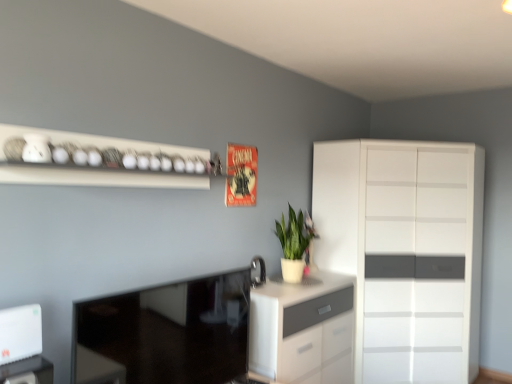
Describe the element at coordinates (302, 330) in the screenshot. This screenshot has width=512, height=384. I see `white matte chest of drawers at center` at that location.

How much space does satin nickel faucet at center, which is counted as the second appliance, starting from the front, occupy vertically?

7.86 inches.

Describe the element at coordinates (162, 334) in the screenshot. The height and width of the screenshot is (384, 512). I see `glossy black tv at lower left` at that location.

The width and height of the screenshot is (512, 384). Identify the location of white plastic router at lower left, which is the 1th appliance in left-to-right order. (20, 333).

Is the position of satin nickel faucet at center, marked as the 1th appliance in a back-to-front arrangement, less distant than that of white glossy cupboard at right?

Yes, the depth of satin nickel faucet at center, marked as the 1th appliance in a back-to-front arrangement, is less than that of white glossy cupboard at right.

Measure the distance between satin nickel faucet at center, acting as the second appliance starting from the left, and white glossy cupboard at right.

satin nickel faucet at center, acting as the second appliance starting from the left, and white glossy cupboard at right are 3.96 feet apart.

From a real-world perspective, starting from the white glossy cupboard at right, which appliance is the 2nd one vertically above it? Please provide its 2D coordinates.

[(260, 271)]

Considering the relative sizes of satin nickel faucet at center, marked as the 1th appliance in a back-to-front arrangement, and white glossy cupboard at right in the image provided, is satin nickel faucet at center, marked as the 1th appliance in a back-to-front arrangement, shorter than white glossy cupboard at right?

Yes, satin nickel faucet at center, marked as the 1th appliance in a back-to-front arrangement, is shorter than white glossy cupboard at right.

Are white matte chest of drawers at center and white glossy shelf at upper left far apart?

That's right, there is a large distance between white matte chest of drawers at center and white glossy shelf at upper left.

How different are the orientations of white matte chest of drawers at center and white glossy shelf at upper left in degrees?

There is a 0.0226-degree angle between the facing directions of white matte chest of drawers at center and white glossy shelf at upper left.

Between white matte chest of drawers at center and white glossy shelf at upper left, which one appears on the left side from the viewer's perspective?

From the viewer's perspective, white glossy shelf at upper left appears more on the left side.

Is white matte chest of drawers at center thinner than white glossy shelf at upper left?

No, white matte chest of drawers at center is not thinner than white glossy shelf at upper left.

From a real-world perspective, who is located lower, white matte chest of drawers at center or white plastic router at lower left, the 2th appliance in the back-to-front sequence?

white matte chest of drawers at center, from a real-world perspective.

Is white matte chest of drawers at center with white plastic router at lower left, the 2th appliance in the back-to-front sequence?

No.

Which is farther, (x=317, y=307) or (x=34, y=320)?

Positioned behind is point (x=317, y=307).

Which is more to the right, white matte chest of drawers at center or white plastic router at lower left, the 2th appliance in the back-to-front sequence?

From the viewer's perspective, white matte chest of drawers at center appears more on the right side.

Visually, is satin nickel faucet at center, which is counted as the second appliance, starting from the front, positioned to the left or to the right of white glossy shelf at upper left?

Clearly, satin nickel faucet at center, which is counted as the second appliance, starting from the front, is on the right of white glossy shelf at upper left in the image.

Is satin nickel faucet at center, marked as the first appliance in a right-to-left arrangement, smaller than white glossy shelf at upper left?

Yes, satin nickel faucet at center, marked as the first appliance in a right-to-left arrangement, is smaller than white glossy shelf at upper left.

Would you say white glossy shelf at upper left is part of satin nickel faucet at center, acting as the second appliance starting from the left,'s contents?

No, white glossy shelf at upper left is located outside of satin nickel faucet at center, acting as the second appliance starting from the left.

Considering the sizes of satin nickel faucet at center, marked as the 1th appliance in a back-to-front arrangement, and white glossy shelf at upper left in the image, is satin nickel faucet at center, marked as the 1th appliance in a back-to-front arrangement, wider or thinner than white glossy shelf at upper left?

In the image, satin nickel faucet at center, marked as the 1th appliance in a back-to-front arrangement, appears to be more narrow than white glossy shelf at upper left.

From the image's perspective, does white plastic router at lower left, positioned as the first appliance in front-to-back order, appear lower than green matte plant at center?

Yes, from the image's perspective, white plastic router at lower left, positioned as the first appliance in front-to-back order, is below green matte plant at center.

Is white plastic router at lower left, which is the 1th appliance in left-to-right order, facing away from green matte plant at center?

No.

Can you confirm if white plastic router at lower left, positioned as the 2th appliance in right-to-left order, is positioned to the left of green matte plant at center?

Indeed, white plastic router at lower left, positioned as the 2th appliance in right-to-left order, is positioned on the left side of green matte plant at center.

Considering the sizes of white plastic router at lower left, positioned as the first appliance in front-to-back order, and green matte plant at center in the image, is white plastic router at lower left, positioned as the first appliance in front-to-back order, wider or thinner than green matte plant at center?

white plastic router at lower left, positioned as the first appliance in front-to-back order, is thinner than green matte plant at center.

Can you confirm if white matte chest of drawers at center is taller than satin nickel faucet at center, which is counted as the second appliance, starting from the front?

Indeed, white matte chest of drawers at center has a greater height compared to satin nickel faucet at center, which is counted as the second appliance, starting from the front.

Which point is more forward, (278, 355) or (251, 265)?

Point (278, 355)

Are white matte chest of drawers at center and satin nickel faucet at center, marked as the 1th appliance in a back-to-front arrangement, far apart?

No, white matte chest of drawers at center is in close proximity to satin nickel faucet at center, marked as the 1th appliance in a back-to-front arrangement.

From a real-world perspective, between white matte chest of drawers at center and satin nickel faucet at center, marked as the 1th appliance in a back-to-front arrangement, who is vertically lower?

white matte chest of drawers at center, from a real-world perspective.

Is glossy black tv at lower left aimed at green matte plant at center?

No, glossy black tv at lower left is not facing towards green matte plant at center.

Locate an element on the screen. plant that is above the glossy black tv at lower left (from a real-world perspective) is located at coordinates (295, 234).

Does glossy black tv at lower left have a larger size compared to green matte plant at center?

Yes, glossy black tv at lower left is bigger than green matte plant at center.

Is glossy black tv at lower left spatially inside green matte plant at center, or outside of it?

glossy black tv at lower left is located beyond the bounds of green matte plant at center.

Locate an element on the screen. the 2nd appliance positioned above the white glossy cupboard at right (from a real-world perspective) is located at coordinates tap(260, 271).

The image size is (512, 384). What are the coordinates of `chest of drawers that is on the right side of white glossy shelf at upper left` in the screenshot? It's located at (302, 330).

Which object lies further to the anchor point green matte plant at center, white matte chest of drawers at center or satin nickel faucet at center, which is counted as the second appliance, starting from the front?

white matte chest of drawers at center.

Estimate the real-world distances between objects in this image. Which object is closer to satin nickel faucet at center, marked as the 1th appliance in a back-to-front arrangement, white glossy cupboard at right or white plastic router at lower left, the 2th appliance in the back-to-front sequence?

white glossy cupboard at right lies closer to satin nickel faucet at center, marked as the 1th appliance in a back-to-front arrangement, than the other object.

From the picture: When comparing their distances from green matte plant at center, does white glossy cupboard at right or white matte chest of drawers at center seem closer?

Based on the image, white matte chest of drawers at center appears to be nearer to green matte plant at center.

Estimate the real-world distances between objects in this image. Which object is further from white glossy shelf at upper left, white glossy cupboard at right or glossy black tv at lower left?

Among the two, white glossy cupboard at right is located further to white glossy shelf at upper left.

Based on their spatial positions, is white matte chest of drawers at center or glossy black tv at lower left closer to white plastic router at lower left, positioned as the first appliance in front-to-back order?

glossy black tv at lower left is closer to white plastic router at lower left, positioned as the first appliance in front-to-back order.

From the image, which object appears to be farther from white plastic router at lower left, positioned as the 2th appliance in right-to-left order, white glossy shelf at upper left or satin nickel faucet at center, marked as the first appliance in a right-to-left arrangement?

Based on the image, satin nickel faucet at center, marked as the first appliance in a right-to-left arrangement, appears to be further to white plastic router at lower left, positioned as the 2th appliance in right-to-left order.

From the image, which object appears to be nearer to white glossy cupboard at right, white glossy shelf at upper left or white matte chest of drawers at center?

white matte chest of drawers at center.

Which object lies nearer to the anchor point white plastic router at lower left, the 2th appliance in the back-to-front sequence, glossy black tv at lower left or white matte chest of drawers at center?

glossy black tv at lower left is closer to white plastic router at lower left, the 2th appliance in the back-to-front sequence.

Image resolution: width=512 pixels, height=384 pixels. I want to click on appliance located between white plastic router at lower left, positioned as the first appliance in front-to-back order, and white glossy cupboard at right in the left-right direction, so click(260, 271).

Image resolution: width=512 pixels, height=384 pixels. Find the location of `cupboard located between glossy black tv at lower left and green matte plant at center in the depth direction`. cupboard located between glossy black tv at lower left and green matte plant at center in the depth direction is located at coordinates (405, 253).

The height and width of the screenshot is (384, 512). Identify the location of chest of drawers between white plastic router at lower left, the 2th appliance in the back-to-front sequence, and satin nickel faucet at center, marked as the 1th appliance in a back-to-front arrangement, from front to back. (302, 330).

Locate an element on the screen. Image resolution: width=512 pixels, height=384 pixels. chest of drawers between glossy black tv at lower left and satin nickel faucet at center, which is counted as the second appliance, starting from the front, along the z-axis is located at coordinates (302, 330).